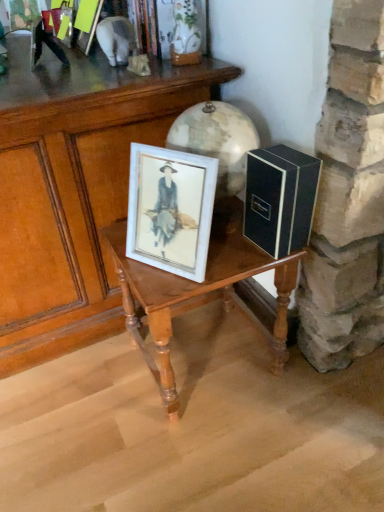
You are a GUI agent. You are given a task and a screenshot of the screen. Output one action in this format:
    pyautogui.click(x=<x>, y=<y>)
    Task: Click on the vacant space in front of wooden table at center, marked as the first table in a right-to-left arrangement
    The width and height of the screenshot is (384, 512).
    Given the screenshot: What is the action you would take?
    pyautogui.click(x=212, y=455)